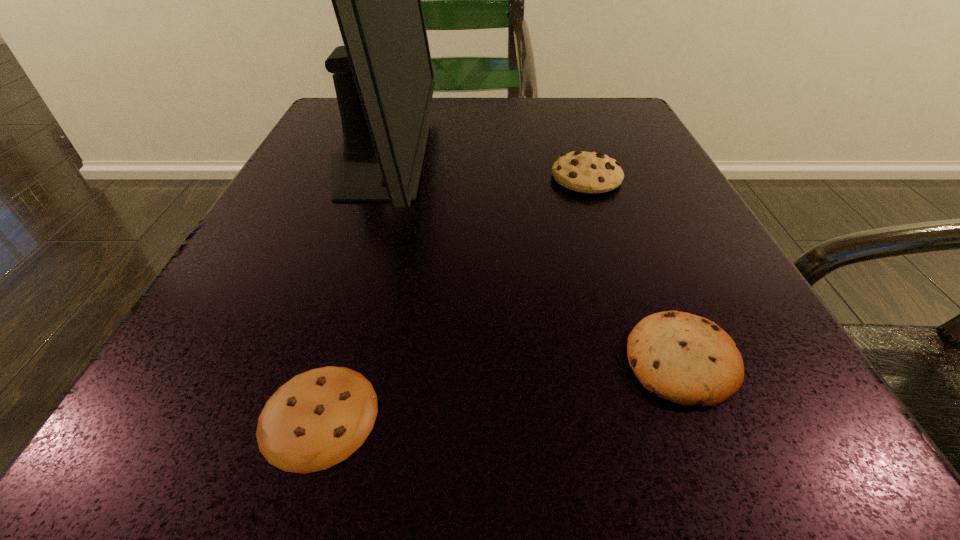
You are a GUI agent. You are given a task and a screenshot of the screen. Output one action in this format:
    pyautogui.click(x=<x>, y=<y>)
    Task: Click on the object positioned at the far edge
    This screenshot has width=960, height=540.
    Given the screenshot: What is the action you would take?
    click(x=383, y=76)

At what (x,y) coordinates should I click in order to perform the action: click on computer monitor that is positioned at the left edge. Please return your answer as a coordinate pair (x, y). The width and height of the screenshot is (960, 540). Looking at the image, I should click on (383, 76).

This screenshot has width=960, height=540. What are the coordinates of `cookie positioned at the left edge` in the screenshot? It's located at (317, 419).

This screenshot has height=540, width=960. I want to click on object at the far left corner, so click(x=383, y=76).

Where is `object that is at the near left corner`? object that is at the near left corner is located at coordinates click(x=317, y=419).

I want to click on object at the near right corner, so click(687, 359).

Where is `free space at the far edge of the desktop`? Image resolution: width=960 pixels, height=540 pixels. free space at the far edge of the desktop is located at coordinates (545, 146).

Identify the location of free region at the left edge. (252, 293).

You are a GUI agent. You are given a task and a screenshot of the screen. Output one action in this format:
    pyautogui.click(x=<x>, y=<y>)
    Task: Click on the free space at the right edge of the desktop
    The image size is (960, 540).
    Given the screenshot: What is the action you would take?
    pyautogui.click(x=619, y=199)

Locate an element on the screen. Image resolution: width=960 pixels, height=540 pixels. vacant space at the far right corner of the desktop is located at coordinates (590, 132).